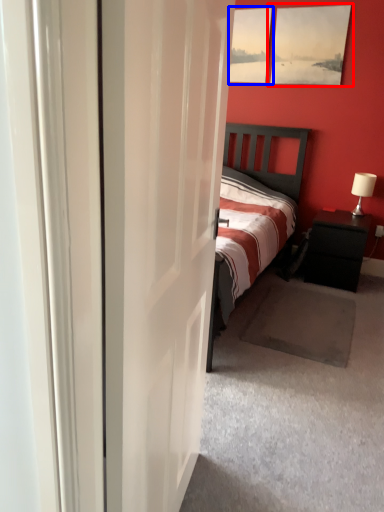
Question: Which object appears closest to the camera in this image, picture frame (highlighted by a red box) or picture frame (highlighted by a blue box)?

Choices:
 (A) picture frame
 (B) picture frame

Answer: (A)